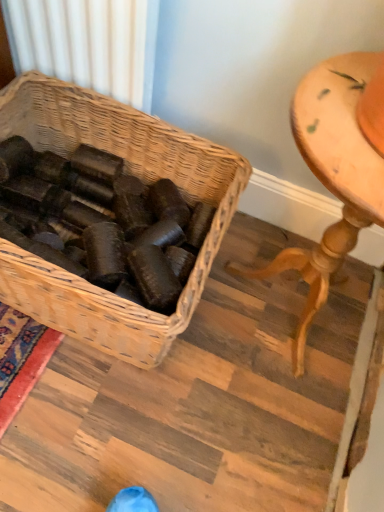
What do you see at coordinates (335, 170) in the screenshot? This screenshot has width=384, height=512. I see `wooden table at right` at bounding box center [335, 170].

Locate an element on the screen. The height and width of the screenshot is (512, 384). wooden table at right is located at coordinates (335, 170).

Where is `woven brown picnic basket at center`? The height and width of the screenshot is (512, 384). woven brown picnic basket at center is located at coordinates (127, 172).

The height and width of the screenshot is (512, 384). What do you see at coordinates (127, 172) in the screenshot? I see `woven brown picnic basket at center` at bounding box center [127, 172].

Measure the distance between point (10, 303) and camera.

Point (10, 303) is 36.89 inches from camera.

The width and height of the screenshot is (384, 512). Find the location of `wooden table at right`. wooden table at right is located at coordinates (335, 170).

Between woven brown picnic basket at center and wooden table at right, which one appears on the right side from the viewer's perspective?

Positioned to the right is wooden table at right.

Is woven brown picnic basket at center in front of wooden table at right?

No, woven brown picnic basket at center is further to the viewer.

Is point (81, 127) positioned in front of point (354, 100)?

No, (81, 127) is behind (354, 100).

From the image's perspective, between woven brown picnic basket at center and wooden table at right, who is located below?

From the image's view, wooden table at right is below.

From a real-world perspective, is woven brown picnic basket at center below wooden table at right?

Yes, from a real-world perspective, woven brown picnic basket at center is beneath wooden table at right.

Considering the sizes of objects woven brown picnic basket at center and wooden table at right in the image provided, who is wider, woven brown picnic basket at center or wooden table at right?

Wider between the two is woven brown picnic basket at center.

Is woven brown picnic basket at center taller or shorter than wooden table at right?

Considering their sizes, woven brown picnic basket at center has less height than wooden table at right.

Considering the relative sizes of woven brown picnic basket at center and wooden table at right in the image provided, is woven brown picnic basket at center bigger than wooden table at right?

Yes, woven brown picnic basket at center is bigger than wooden table at right.

Consider the image. Is wooden table at right completely or partially inside woven brown picnic basket at center?

No.

Is the surface of woven brown picnic basket at center in direct contact with wooden table at right?

No, woven brown picnic basket at center is not touching wooden table at right.

Is woven brown picnic basket at center turned away from wooden table at right?

That's not correct — woven brown picnic basket at center is not looking away from wooden table at right.

This screenshot has height=512, width=384. I want to click on picnic basket lying above the wooden table at right (from the image's perspective), so click(x=127, y=172).

Does wooden table at right appear on the left side of woven brown picnic basket at center?

In fact, wooden table at right is to the right of woven brown picnic basket at center.

Which object is more forward, wooden table at right or woven brown picnic basket at center?

wooden table at right is closer to the camera.

Which is farther from the camera, (373, 179) or (95, 321)?

The point (95, 321) is farther from the camera.

From the image's perspective, would you say wooden table at right is positioned over woven brown picnic basket at center?

Actually, wooden table at right appears below woven brown picnic basket at center in the image.

From a real-world perspective, is wooden table at right on woven brown picnic basket at center?

Yes, from a real-world perspective, wooden table at right is over woven brown picnic basket at center

Between wooden table at right and woven brown picnic basket at center, which one has larger width?

Wider between the two is woven brown picnic basket at center.

Can you confirm if wooden table at right is shorter than woven brown picnic basket at center?

Incorrect, the height of wooden table at right does not fall short of that of woven brown picnic basket at center.

Is wooden table at right smaller than woven brown picnic basket at center?

Yes.

Is woven brown picnic basket at center surrounded by wooden table at right?

No, woven brown picnic basket at center is not a part of wooden table at right.

Is wooden table at right far away from woven brown picnic basket at center?

No, wooden table at right is not far away from woven brown picnic basket at center.

Is wooden table at right facing towards woven brown picnic basket at center?

No, wooden table at right is not aimed at woven brown picnic basket at center.

How much distance is there between wooden table at right and woven brown picnic basket at center?

wooden table at right is 36.07 centimeters from woven brown picnic basket at center.

At what (x,y) coordinates should I click in order to perform the action: click on picnic basket located on the left of wooden table at right. Please return your answer as a coordinate pair (x, y). Image resolution: width=384 pixels, height=512 pixels. Looking at the image, I should click on (127, 172).

Find the location of `picnic basket below the wooden table at right (from a real-world perspective)`. picnic basket below the wooden table at right (from a real-world perspective) is located at coordinates (127, 172).

At what (x,y) coordinates should I click in order to perform the action: click on furniture that is below the woven brown picnic basket at center (from the image's perspective). Please return your answer as a coordinate pair (x, y). This screenshot has height=512, width=384. Looking at the image, I should click on (335, 170).